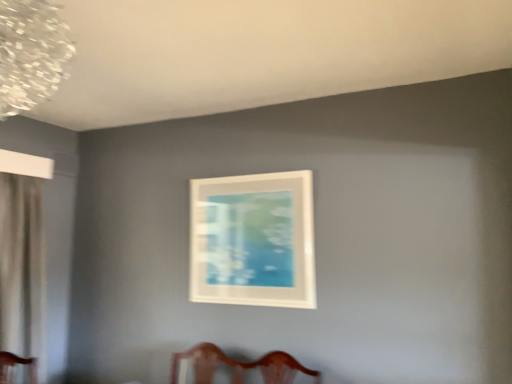
Question: Is white matte picture frame at center at the left side of clear crystal chandelier at upper left?

Choices:
 (A) no
 (B) yes

Answer: (A)

Question: Is clear crystal chandelier at upper left inside white matte picture frame at center?

Choices:
 (A) no
 (B) yes

Answer: (A)

Question: Is white matte picture frame at center smaller than clear crystal chandelier at upper left?

Choices:
 (A) no
 (B) yes

Answer: (B)

Question: From a real-world perspective, is white matte picture frame at center beneath clear crystal chandelier at upper left?

Choices:
 (A) yes
 (B) no

Answer: (A)

Question: From a real-world perspective, is white matte picture frame at center positioned over clear crystal chandelier at upper left based on gravity?

Choices:
 (A) yes
 (B) no

Answer: (B)

Question: Is white matte picture frame at center with clear crystal chandelier at upper left?

Choices:
 (A) no
 (B) yes

Answer: (A)

Question: Considering the relative sizes of clear crystal chandelier at upper left and white matte picture frame at center in the image provided, is clear crystal chandelier at upper left thinner than white matte picture frame at center?

Choices:
 (A) no
 (B) yes

Answer: (A)

Question: Is clear crystal chandelier at upper left aimed at white matte picture frame at center?

Choices:
 (A) yes
 (B) no

Answer: (B)

Question: Would you say clear crystal chandelier at upper left is a long distance from white matte picture frame at center?

Choices:
 (A) yes
 (B) no

Answer: (A)

Question: Is clear crystal chandelier at upper left bigger than white matte picture frame at center?

Choices:
 (A) no
 (B) yes

Answer: (B)

Question: Is clear crystal chandelier at upper left shorter than white matte picture frame at center?

Choices:
 (A) yes
 (B) no

Answer: (A)

Question: Is white matte picture frame at center at the back of clear crystal chandelier at upper left?

Choices:
 (A) no
 (B) yes

Answer: (A)

Question: Is clear crystal chandelier at upper left thinner than white sheer curtain at left?

Choices:
 (A) no
 (B) yes

Answer: (A)